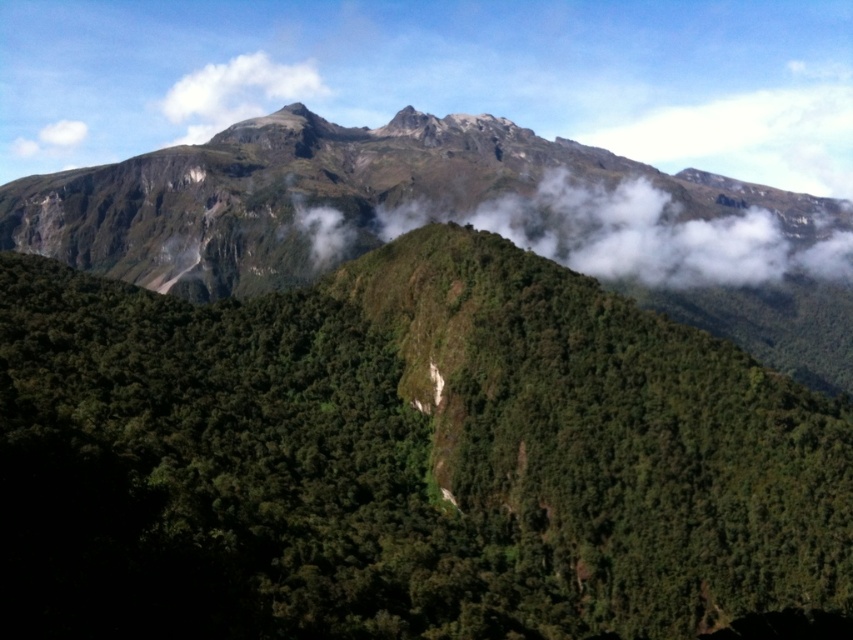
Question: Which point is farther to the camera?

Choices:
 (A) (207, 147)
 (B) (595, 225)

Answer: (A)

Question: Is rugged rock mountain at upper center positioned behind white fluffy cloud at center?

Choices:
 (A) no
 (B) yes

Answer: (B)

Question: Which point is farther from the camera taking this photo?

Choices:
 (A) (229, 97)
 (B) (236, 132)
 (C) (595, 524)

Answer: (A)

Question: Can you confirm if green leafy hillside at center is positioned to the right of white fluffy cloud at upper left?

Choices:
 (A) no
 (B) yes

Answer: (B)

Question: Is rugged rock mountain at upper center thinner than white fluffy cloud at upper center?

Choices:
 (A) yes
 (B) no

Answer: (B)

Question: Among these points, which one is farthest from the camera?

Choices:
 (A) (80, 125)
 (B) (300, 456)

Answer: (A)